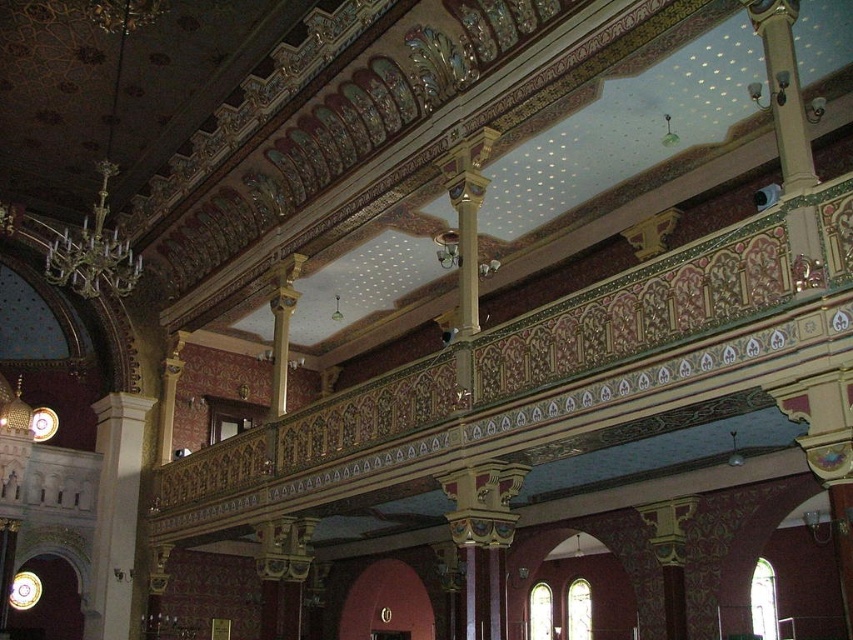
Is white marble column at left shorter than gold-bronze chandelier at upper left?

Incorrect, white marble column at left's height does not fall short of gold-bronze chandelier at upper left's.

Find the location of a particular element. This screenshot has width=853, height=640. white marble column at left is located at coordinates (115, 513).

Where is `white marble column at left`? white marble column at left is located at coordinates (115, 513).